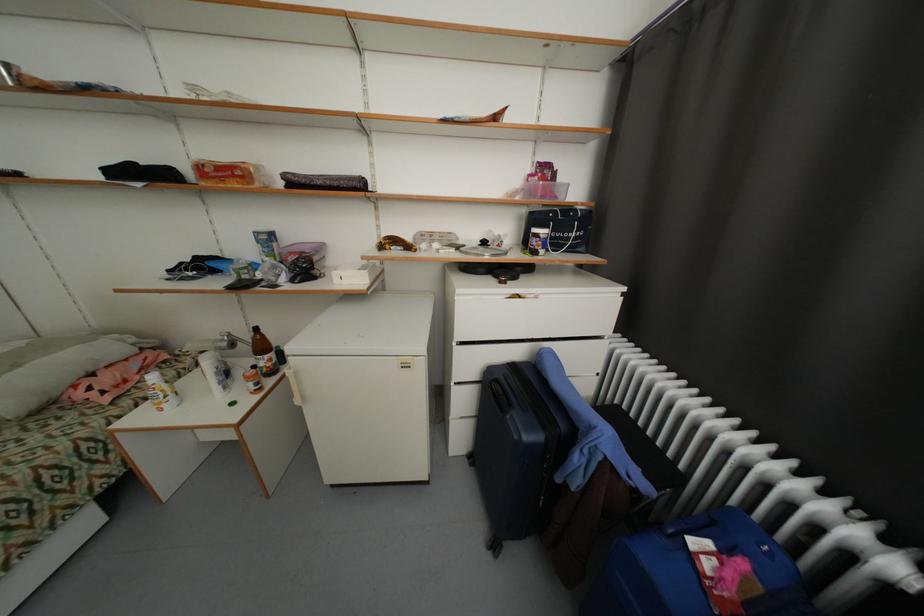
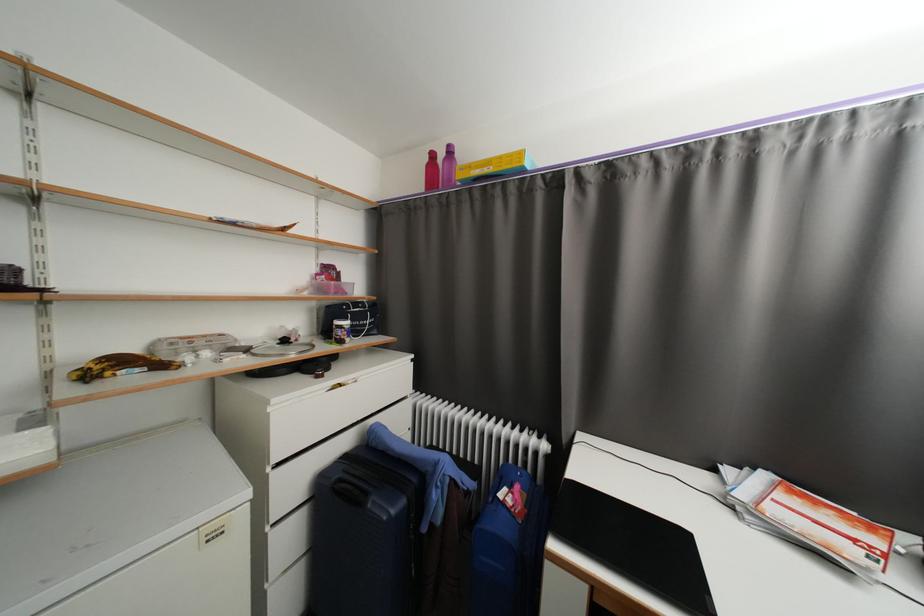
Locate, in the second image, the point that corresponds to the point at 540,243 in the first image.

(346, 334)